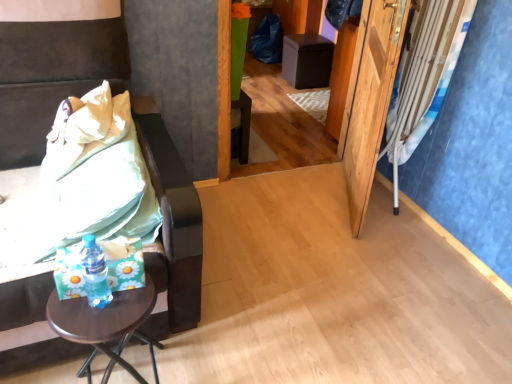
Question: From the image's perspective, is brown wooden table at lower left located beneath brown wooden side table at left, which ranks as the second furniture in back-to-front order?

Choices:
 (A) no
 (B) yes

Answer: (B)

Question: Can we say brown wooden table at lower left lies outside brown wooden side table at left, the first furniture in the bottom-to-top sequence?

Choices:
 (A) no
 (B) yes

Answer: (B)

Question: Is brown wooden table at lower left next to brown wooden side table at left, marked as the 1th furniture in a front-to-back arrangement?

Choices:
 (A) no
 (B) yes

Answer: (A)

Question: Is brown wooden table at lower left surrounding brown wooden side table at left, which ranks as the second furniture in back-to-front order?

Choices:
 (A) yes
 (B) no

Answer: (B)

Question: Is brown wooden table at lower left shorter than brown wooden side table at left, marked as the second furniture in a right-to-left arrangement?

Choices:
 (A) yes
 (B) no

Answer: (A)

Question: Does brown wooden table at lower left appear on the right side of brown wooden side table at left, which appears as the 1th furniture when viewed from the left?

Choices:
 (A) no
 (B) yes

Answer: (B)

Question: From the image's perspective, is blue fabric curtain at right beneath brown wooden table at lower left?

Choices:
 (A) yes
 (B) no

Answer: (B)

Question: Considering the relative positions of blue fabric curtain at right and brown wooden table at lower left in the image provided, is blue fabric curtain at right to the left of brown wooden table at lower left from the viewer's perspective?

Choices:
 (A) no
 (B) yes

Answer: (A)

Question: Is brown wooden table at lower left surrounded by blue fabric curtain at right?

Choices:
 (A) no
 (B) yes

Answer: (A)

Question: Is blue fabric curtain at right smaller than brown wooden table at lower left?

Choices:
 (A) no
 (B) yes

Answer: (A)

Question: From the image's perspective, would you say blue fabric curtain at right is positioned over brown wooden table at lower left?

Choices:
 (A) no
 (B) yes

Answer: (B)

Question: Is blue fabric curtain at right far from brown wooden table at lower left?

Choices:
 (A) no
 (B) yes

Answer: (B)

Question: Is green fabric bedsheet at left bigger than translucent plastic bottle at lower left?

Choices:
 (A) yes
 (B) no

Answer: (A)